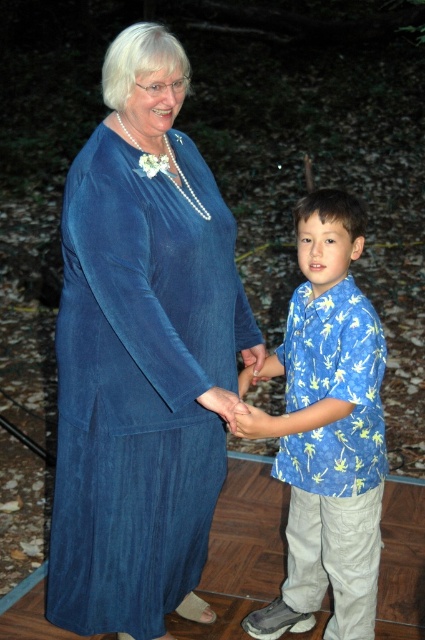
Who is positioned more to the right, blue printed shirt at center or matte blue hand at center?

Positioned to the right is blue printed shirt at center.

Is point (356, 212) farther from camera compared to point (278, 420)?

Yes, point (356, 212) is behind point (278, 420).

This screenshot has width=425, height=640. Find the location of `blue printed shirt at center`. blue printed shirt at center is located at coordinates (328, 429).

Can you confirm if velvet blue dress at center is shorter than blue printed shirt at center?

No.

In the scene shown: Is velvet blue dress at center above blue printed shirt at center?

Yes.

Is point (155, 298) closer to camera compared to point (275, 419)?

Yes, it is.

Where is `velvet blue dress at center`? The width and height of the screenshot is (425, 640). velvet blue dress at center is located at coordinates (138, 387).

Which is more to the left, velvet blue dress at center or matte blue hand at center?

Positioned to the left is velvet blue dress at center.

Which is behind, point (127, 324) or point (269, 424)?

Positioned behind is point (269, 424).

You are a GUI agent. You are given a task and a screenshot of the screen. Output one action in this format:
    pyautogui.click(x=<x>, y=<y>)
    Task: Click on the velvet blue dress at center
    The width and height of the screenshot is (425, 640).
    Given the screenshot: What is the action you would take?
    pyautogui.click(x=138, y=387)

Find the location of `velvet blue dress at center`. velvet blue dress at center is located at coordinates (138, 387).